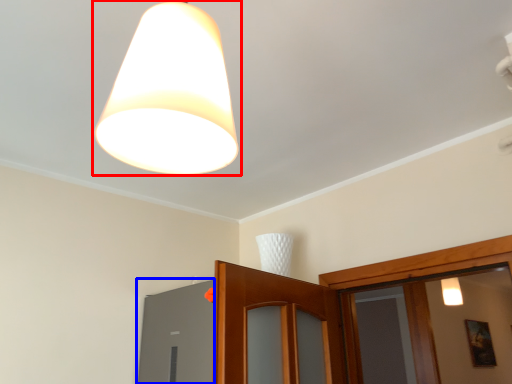
Question: Which object is further to the camera taking this photo, lamp (highlighted by a red box) or window (highlighted by a blue box)?

Choices:
 (A) lamp
 (B) window

Answer: (B)